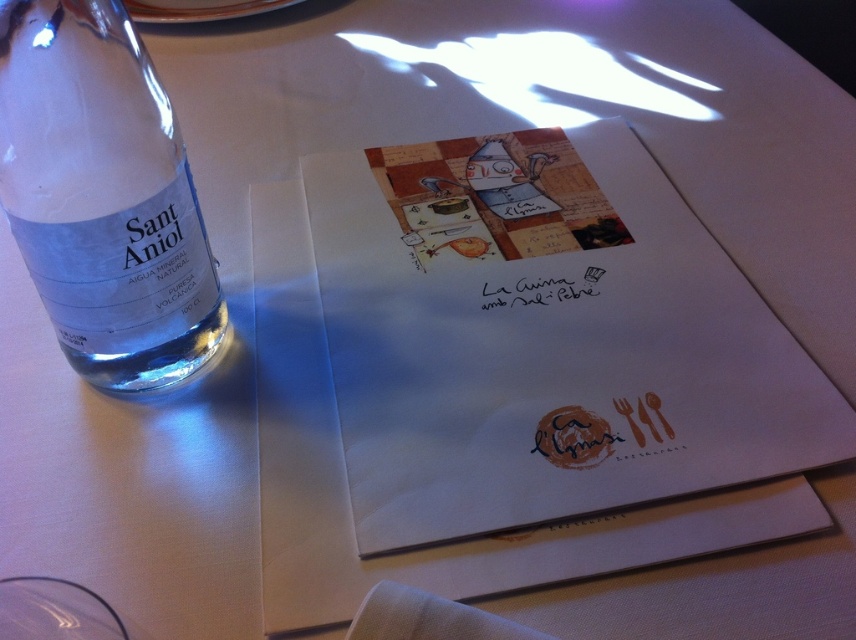
Does white paper menu at center lie behind clear glass bottle at left?

Yes, it is.

Can you confirm if white paper menu at center is positioned to the left of clear glass bottle at left?

Incorrect, white paper menu at center is not on the left side of clear glass bottle at left.

Does point (551, 257) come behind point (174, 216)?

Yes, point (551, 257) is behind point (174, 216).

I want to click on white paper menu at center, so click(x=544, y=339).